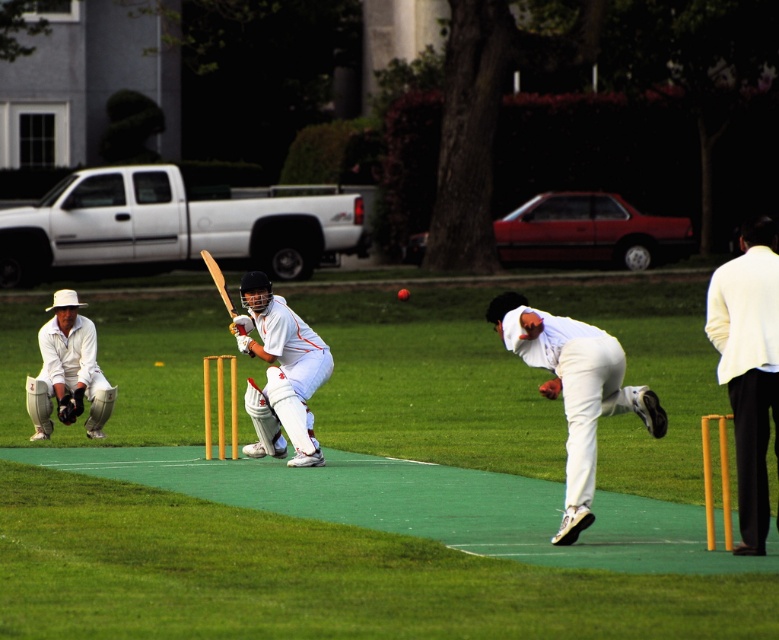
Question: Can you confirm if white clothed bowler at center is positioned below white matte cricket gear at left?

Choices:
 (A) no
 (B) yes

Answer: (B)

Question: Does white cloth jacket at upper right appear over white clothed bowler at center?

Choices:
 (A) yes
 (B) no

Answer: (A)

Question: Which object appears closest to the camera in this image?

Choices:
 (A) white cloth jacket at upper right
 (B) white matte cricket bat at center
 (C) white matte cricket gear at left

Answer: (A)

Question: Is the position of white clothed bowler at center more distant than that of white matte cricket gear at left?

Choices:
 (A) yes
 (B) no

Answer: (B)

Question: Which of the following is the closest to the observer?

Choices:
 (A) white clothed bowler at center
 (B) white matte cricket gear at left
 (C) white matte cricket bat at center

Answer: (A)

Question: Which point is closer to the camera taking this photo?

Choices:
 (A) [605, 356]
 (B) [724, 362]
 (C) [41, 376]

Answer: (B)